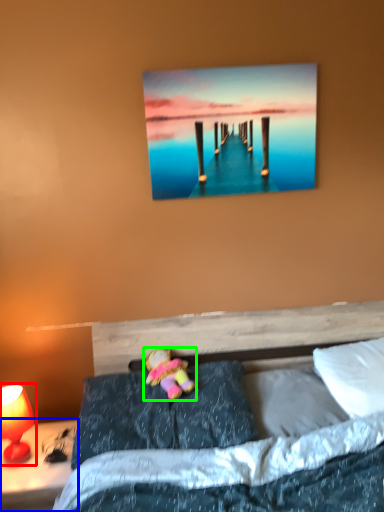
Question: Considering the real-world distances, which object is closest to table lamp (highlighted by a red box)? nightstand (highlighted by a blue box) or doll (highlighted by a green box).

Choices:
 (A) nightstand
 (B) doll

Answer: (A)